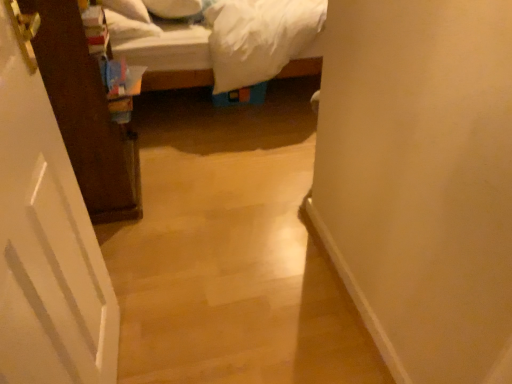
Question: Does white soft pillow at upper left, the 1th pillow positioned from the left, contain white soft pillow at upper center, positioned as the 2th pillow in left-to-right order?

Choices:
 (A) yes
 (B) no

Answer: (B)

Question: Does white soft pillow at upper left, which is the second pillow from right to left, have a lesser width compared to white soft pillow at upper center, which appears as the first pillow when viewed from the right?

Choices:
 (A) no
 (B) yes

Answer: (B)

Question: Is white soft pillow at upper left, which is the second pillow from right to left, touching white soft pillow at upper center, which appears as the first pillow when viewed from the right?

Choices:
 (A) yes
 (B) no

Answer: (B)

Question: Is white soft pillow at upper left, which is the second pillow from right to left, taller than white soft pillow at upper center, positioned as the 2th pillow in left-to-right order?

Choices:
 (A) no
 (B) yes

Answer: (B)

Question: Is the depth of white soft pillow at upper left, the 1th pillow positioned from the left, less than that of white soft pillow at upper center, positioned as the 2th pillow in left-to-right order?

Choices:
 (A) no
 (B) yes

Answer: (B)

Question: From the image's perspective, is white soft pillow at upper center, positioned as the 2th pillow in left-to-right order, located above or below white matte door at left?

Choices:
 (A) below
 (B) above

Answer: (B)

Question: Is white soft pillow at upper center, positioned as the 2th pillow in left-to-right order, taller or shorter than white matte door at left?

Choices:
 (A) tall
 (B) short

Answer: (B)

Question: In terms of width, does white soft pillow at upper center, positioned as the 2th pillow in left-to-right order, look wider or thinner when compared to white matte door at left?

Choices:
 (A) wide
 (B) thin

Answer: (A)

Question: Is point pyautogui.click(x=143, y=1) closer or farther from the camera than point pyautogui.click(x=5, y=344)?

Choices:
 (A) farther
 (B) closer

Answer: (A)

Question: Is point (52, 289) closer or farther from the camera than point (193, 6)?

Choices:
 (A) closer
 (B) farther

Answer: (A)

Question: In the image, is white matte door at left positioned in front of or behind white soft pillow at upper center, positioned as the 2th pillow in left-to-right order?

Choices:
 (A) front
 (B) behind

Answer: (A)

Question: From a real-world perspective, is white matte door at left above or below white soft pillow at upper center, positioned as the 2th pillow in left-to-right order?

Choices:
 (A) below
 (B) above

Answer: (A)

Question: In terms of height, does white matte door at left look taller or shorter compared to white soft pillow at upper center, which appears as the first pillow when viewed from the right?

Choices:
 (A) tall
 (B) short

Answer: (A)

Question: Looking at their shapes, would you say white soft pillow at upper left, the 1th pillow positioned from the left, is wider or thinner than white matte door at left?

Choices:
 (A) thin
 (B) wide

Answer: (B)

Question: From the image's perspective, relative to white matte door at left, is white soft pillow at upper left, which is the second pillow from right to left, above or below?

Choices:
 (A) above
 (B) below

Answer: (A)